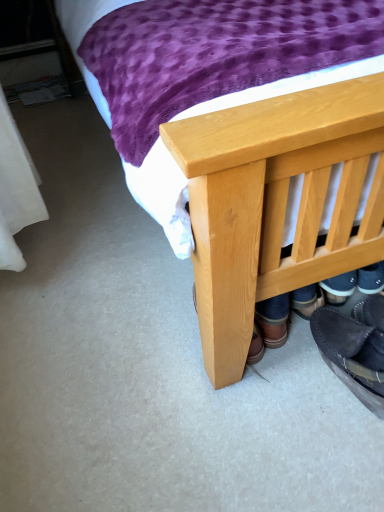
Locate an element on the screen. empty space that is ontop of dark brown leather shoe at lower right (from a real-world perspective) is located at coordinates (367, 357).